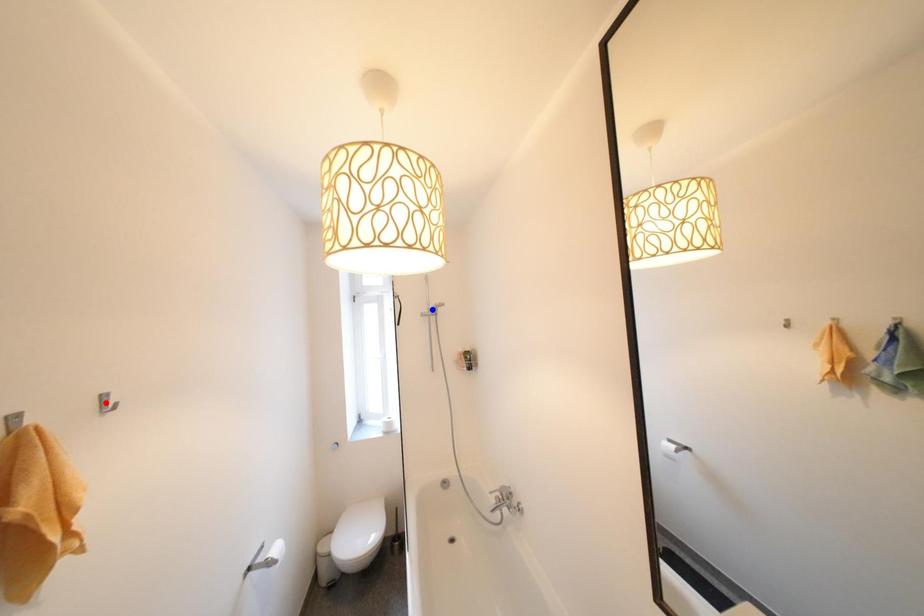
Question: Two points are marked on the image. Which point is closer to the camera?

Choices:
 (A) Blue point is closer.
 (B) Red point is closer.

Answer: (B)